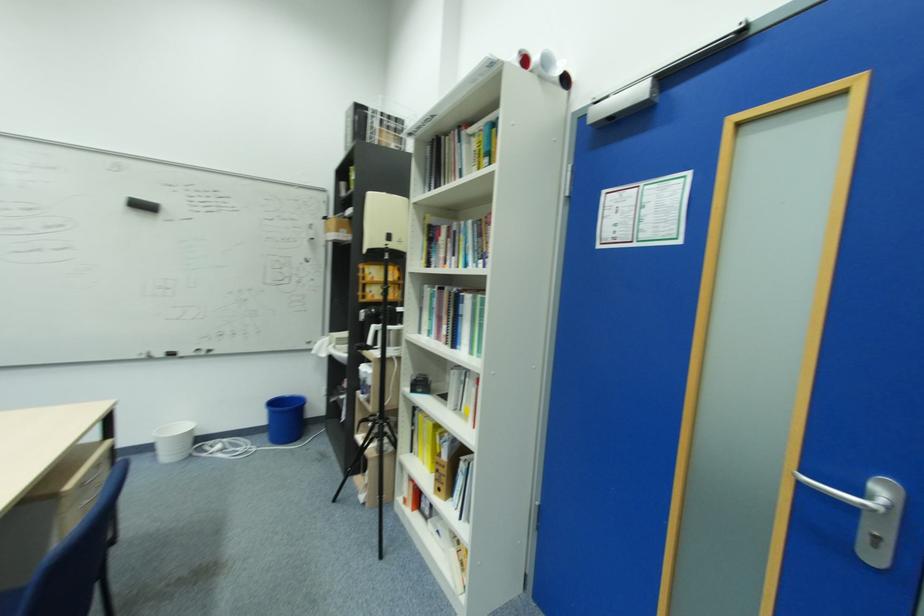
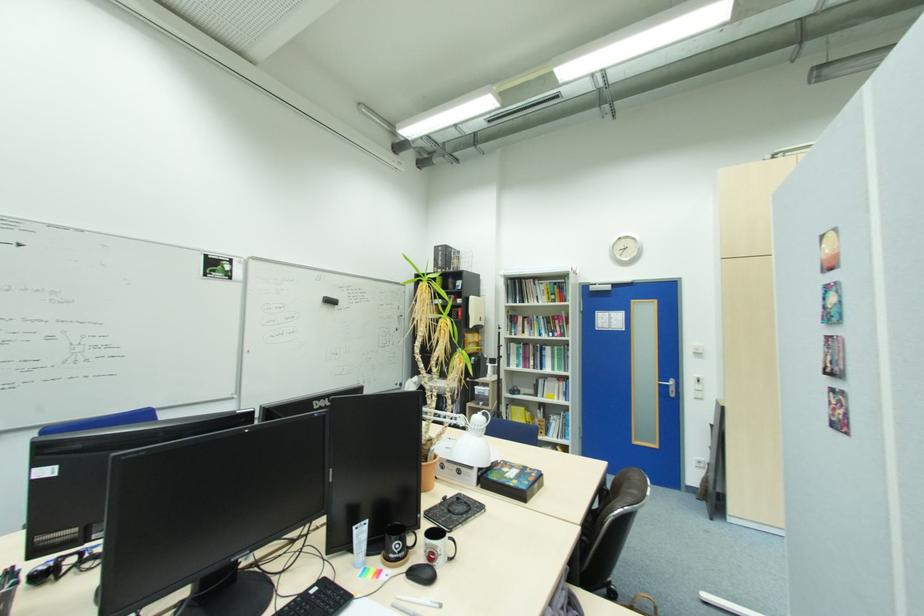
Locate, in the second image, the point that corresponds to the point at 147,206 in the first image.

(334, 302)